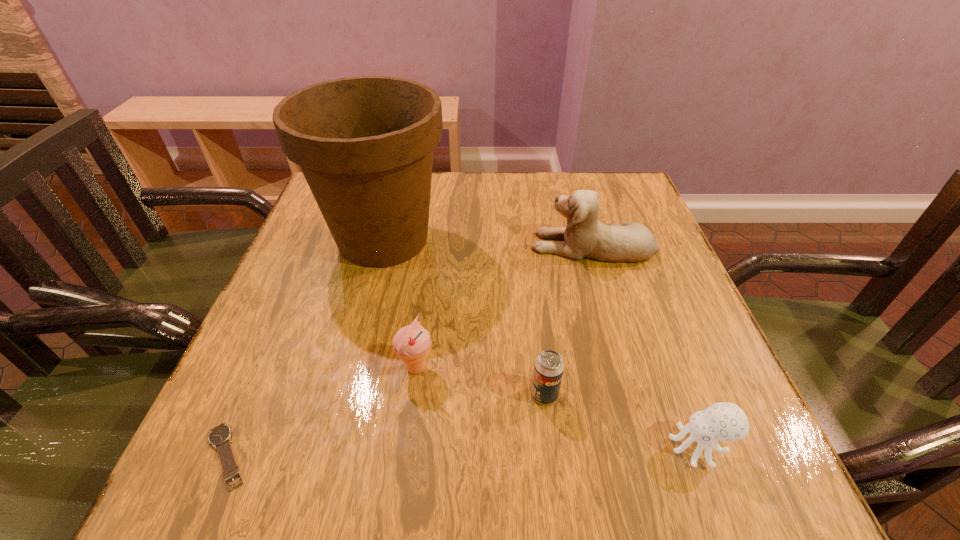
Locate an element on the screen. This screenshot has height=540, width=960. the third closest object to the beer can is located at coordinates (365, 145).

Image resolution: width=960 pixels, height=540 pixels. Find the location of `free space that satisfies the following two spatial constraints: 1. on the back side of the shortest object; 2. on the right side of the tallest object`. free space that satisfies the following two spatial constraints: 1. on the back side of the shortest object; 2. on the right side of the tallest object is located at coordinates (320, 239).